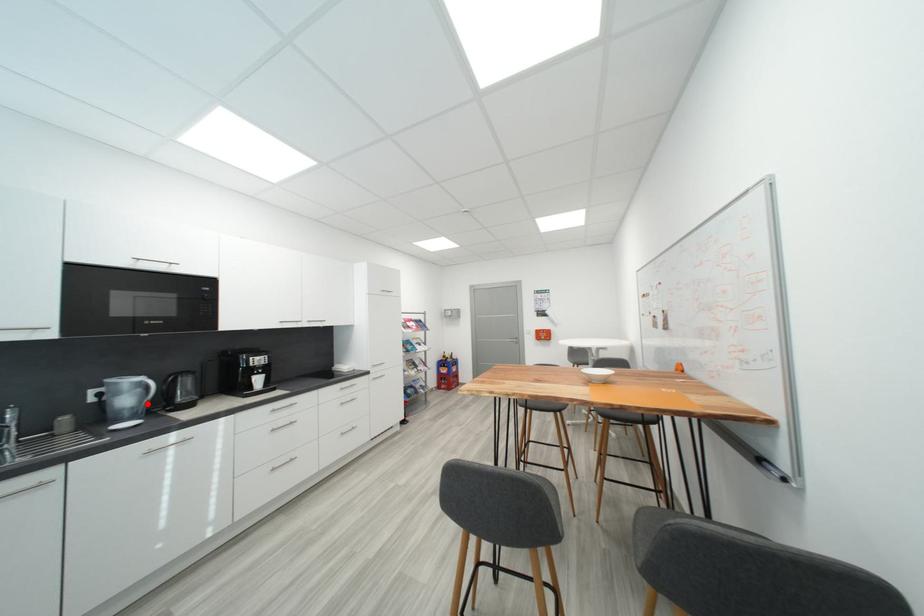
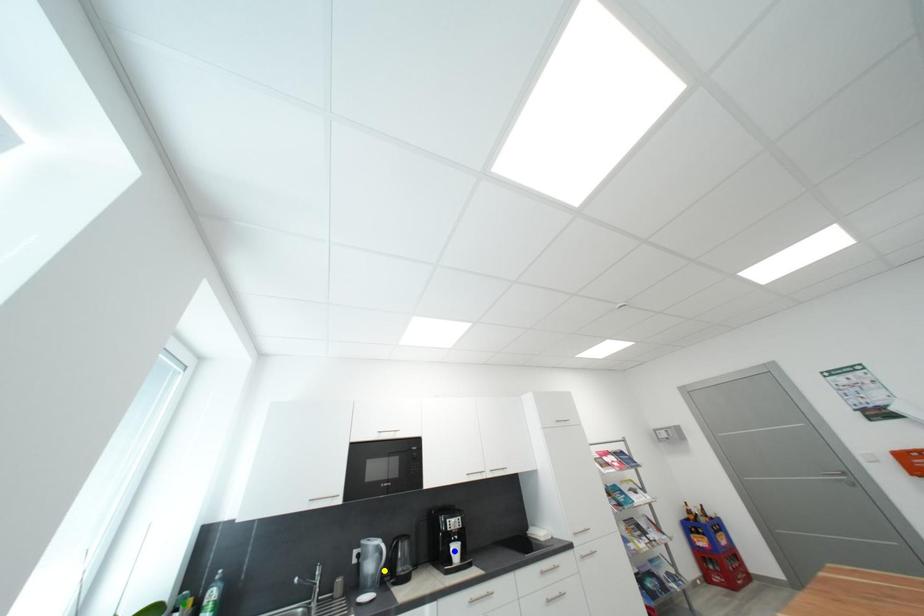
Question: I am providing you with two images of the same scene from different viewpoints. A red point is marked on the first image. You are given multiple points on the second image. Which spot in image 2 lines up with the point in image 1?

Choices:
 (A) yellow point
 (B) green point
 (C) blue point

Answer: (A)